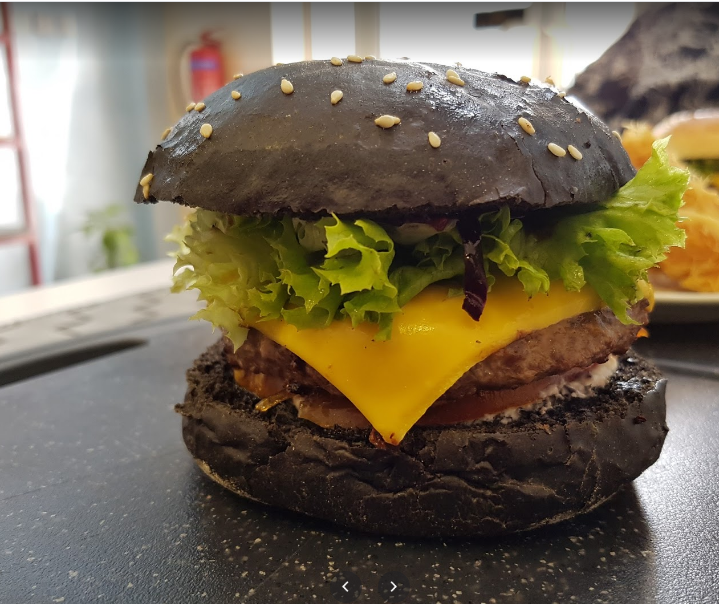
Locate an element on the screen. Image resolution: width=719 pixels, height=604 pixels. fire extinguisher is located at coordinates pos(198,69).